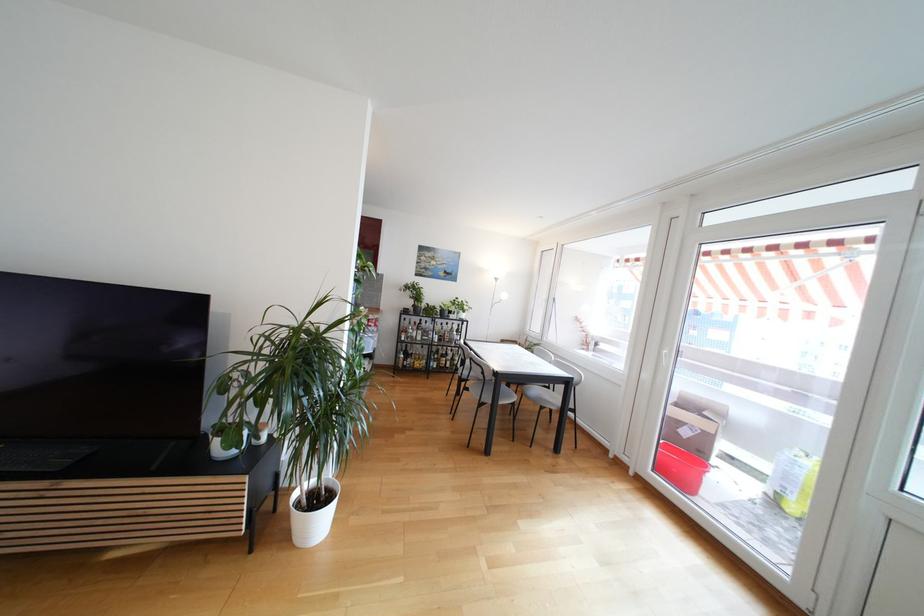
Where would you pull the white door handle? Please return your answer as a coordinate pair (x, y).

(663, 358)